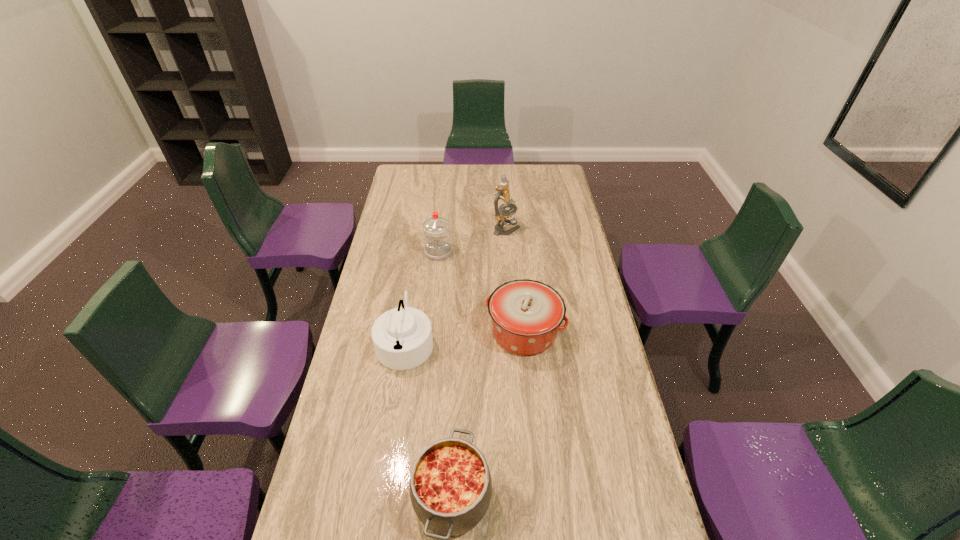
Locate an element on the screen. the farthest object is located at coordinates (503, 216).

Identify the location of microscope. (503, 216).

The width and height of the screenshot is (960, 540). I want to click on the fourth nearest object, so click(x=436, y=230).

Where is `kettle`? kettle is located at coordinates (402, 337).

In order to click on the farther casserole in this screenshot , I will do `click(526, 314)`.

The height and width of the screenshot is (540, 960). In order to click on blank area located on the front of the tallest object in this screenshot , I will do `click(509, 264)`.

What are the coordinates of `vacant position located on the handle side of the fourth nearest object` in the screenshot? It's located at (433, 306).

Where is `blank space located on the spout of the kettle`? This screenshot has height=540, width=960. blank space located on the spout of the kettle is located at coordinates (489, 341).

Locate an element on the screen. The height and width of the screenshot is (540, 960). free spot located on the left of the taller casserole is located at coordinates (415, 332).

Where is `object that is at the left edge`? The width and height of the screenshot is (960, 540). object that is at the left edge is located at coordinates (402, 337).